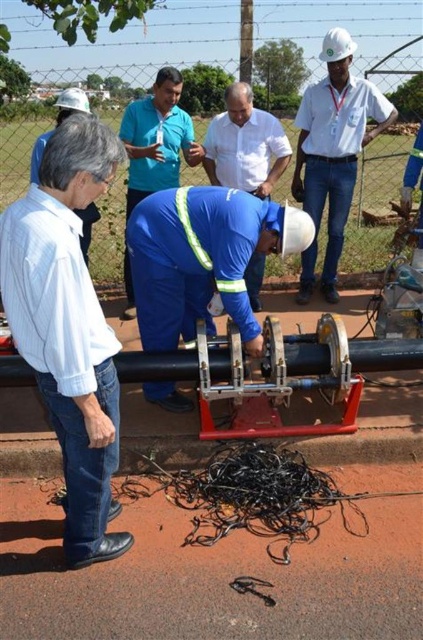
You are a safety inspector standing at the viewer position. You need to check the blue reflective safety vest at center. Can you reach it within 10 feet without moving?

The blue reflective safety vest at center is 14.96 feet away from the viewer, so you cannot reach it within 10 feet without moving.